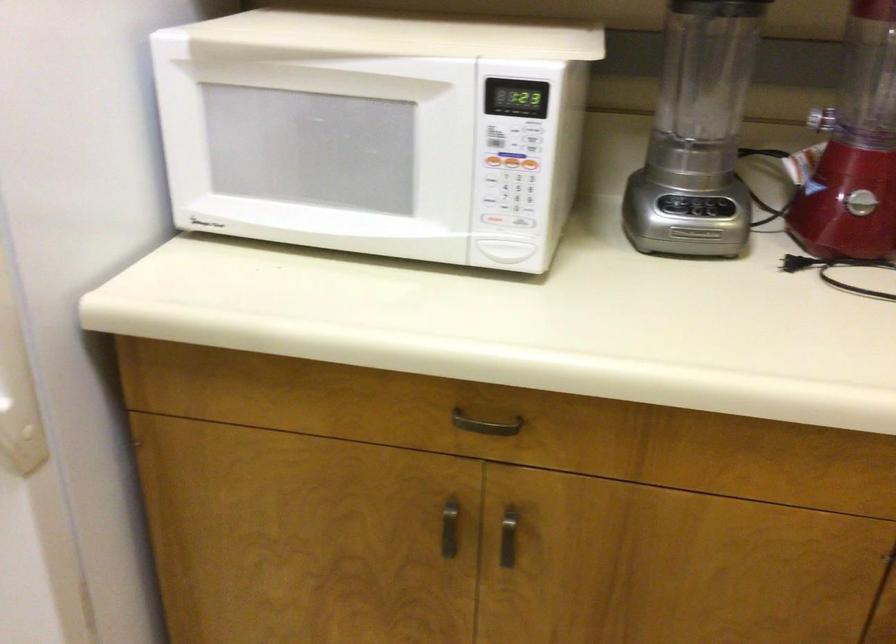
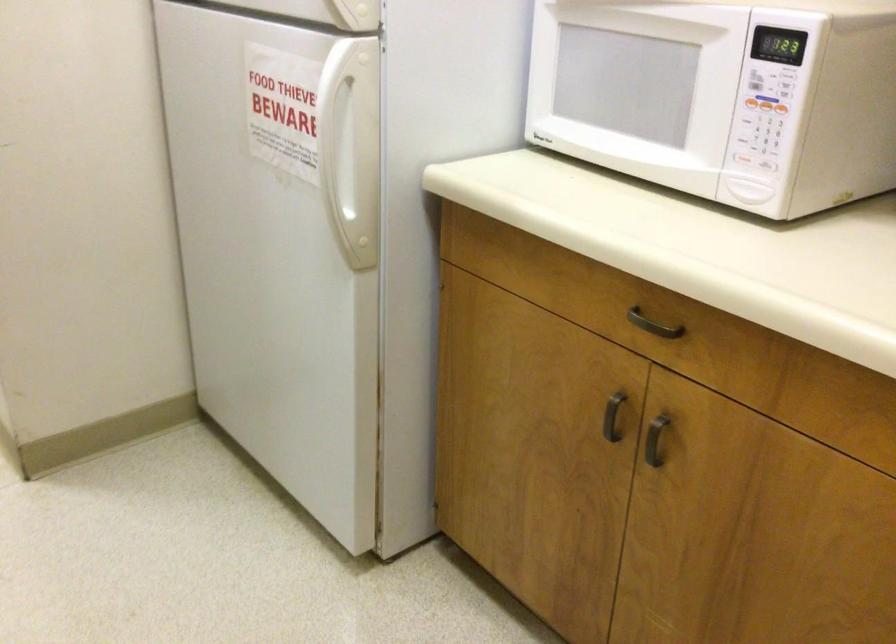
Find the pixel in the second image that matches (x=532, y=165) in the first image.

(780, 108)